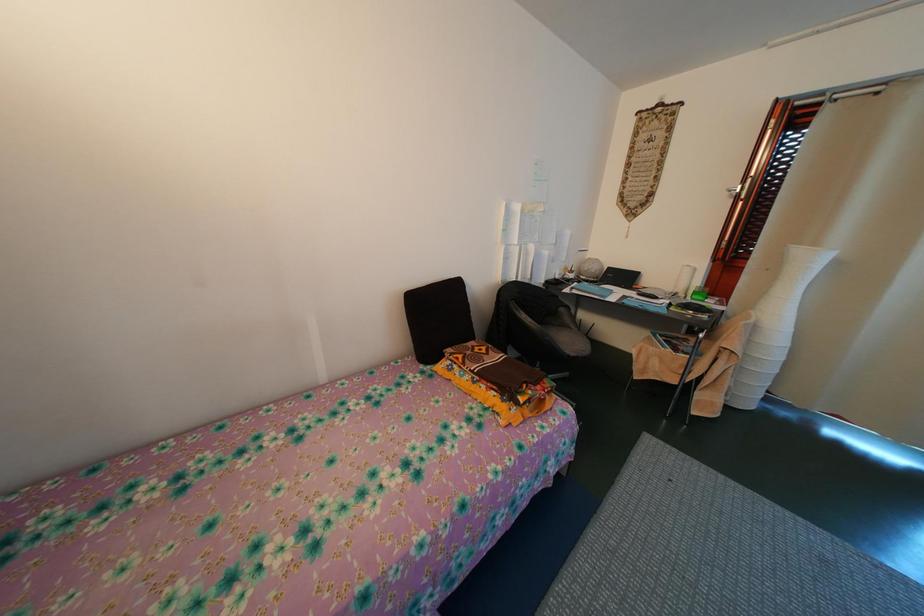
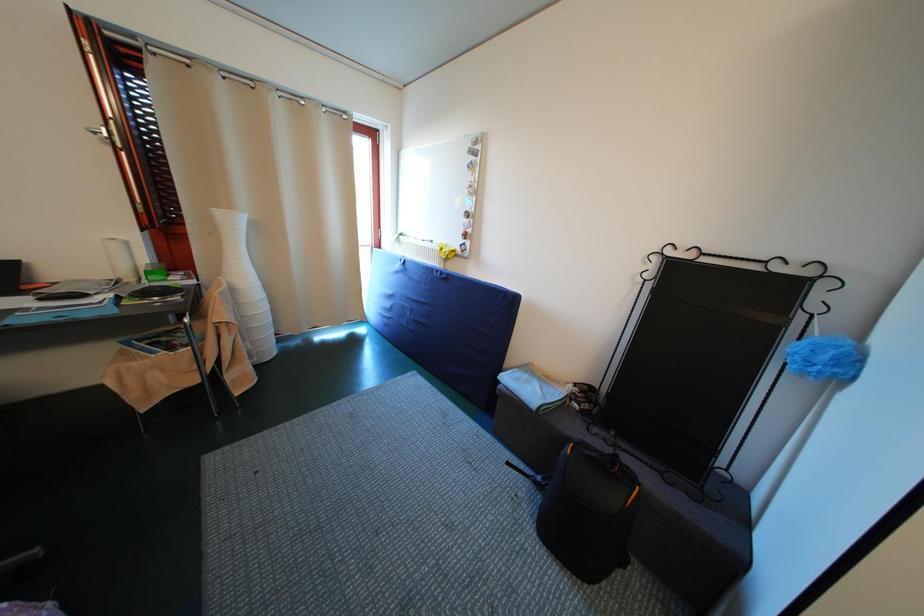
The images are taken continuously from a first-person perspective. In which direction is your viewpoint rotating?

The camera's rotation is toward right-down.